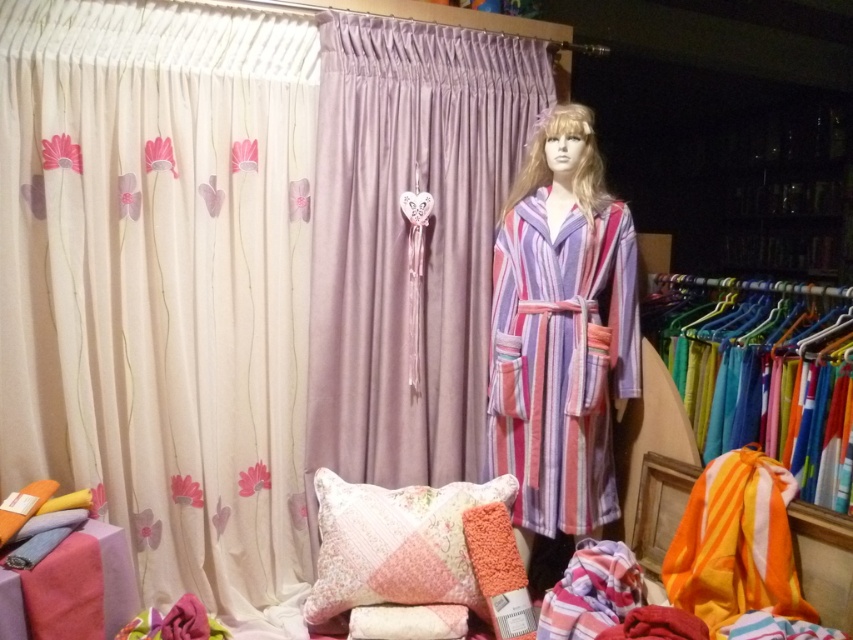
Question: Among these points, which one is nearest to the camera?

Choices:
 (A) (370, 492)
 (B) (456, 352)

Answer: (A)

Question: Estimate the real-world distances between objects in this image. Which object is farther from the creamy satin curtain at left?

Choices:
 (A) fluffy pink pillow at center
 (B) lavender satin curtain at center

Answer: (A)

Question: Which object is positioned farthest from the fluffy pink pillow at center?

Choices:
 (A) lavender satin curtain at center
 (B) creamy satin curtain at left
 (C) striped fabric robe at center

Answer: (B)

Question: From the image, what is the correct spatial relationship of creamy satin curtain at left in relation to striped fabric robe at center?

Choices:
 (A) right
 (B) left

Answer: (B)

Question: Does creamy satin curtain at left come in front of striped fabric robe at center?

Choices:
 (A) yes
 (B) no

Answer: (A)

Question: Can you confirm if creamy satin curtain at left is wider than lavender satin curtain at center?

Choices:
 (A) yes
 (B) no

Answer: (A)